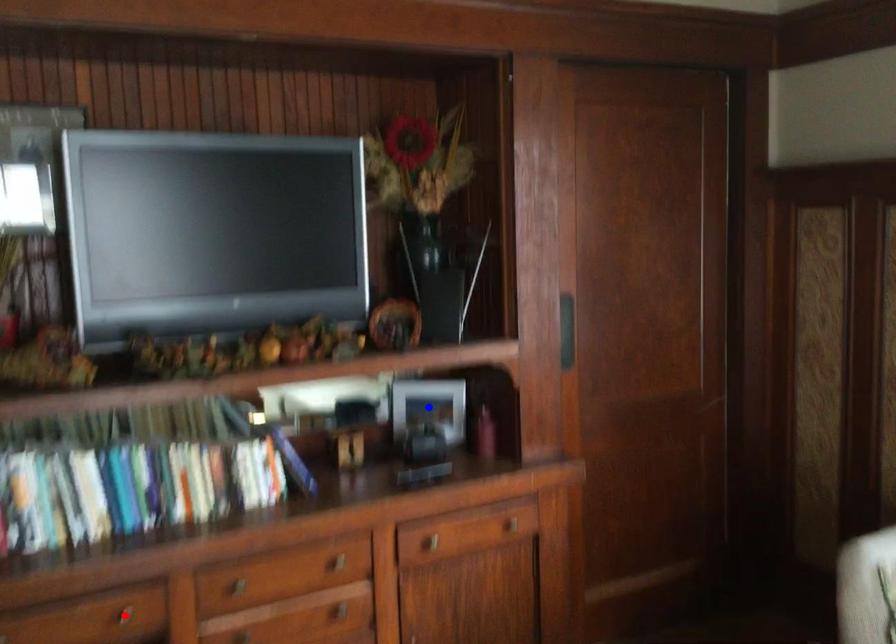
Question: Which of the two points in the image is closer to the camera?

Choices:
 (A) Blue point is closer.
 (B) Red point is closer.

Answer: (B)